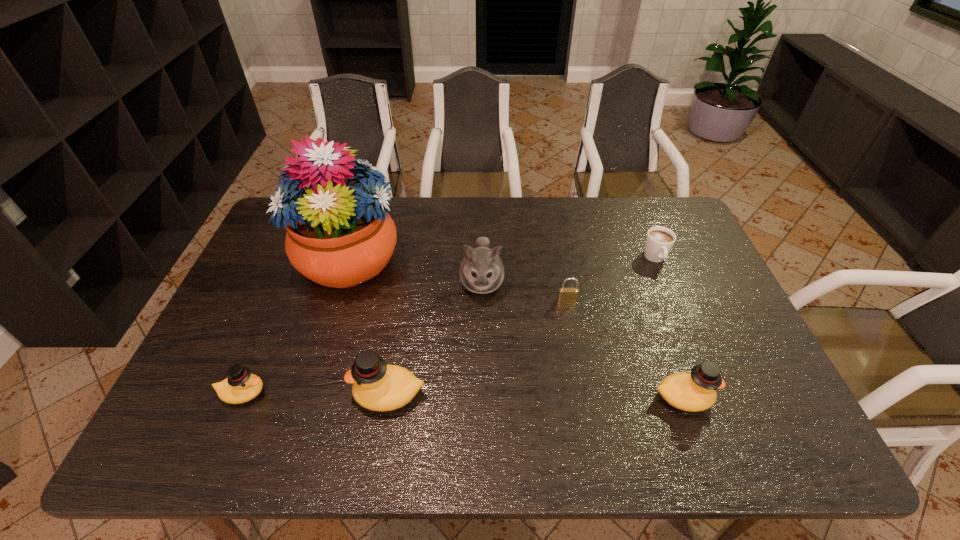
I want to click on duck that is at the right edge, so click(x=696, y=391).

Where is `cappuccino that is positioned at the right edge`? This screenshot has width=960, height=540. cappuccino that is positioned at the right edge is located at coordinates (659, 241).

The width and height of the screenshot is (960, 540). Identify the location of object present at the far left corner. (339, 235).

The width and height of the screenshot is (960, 540). I want to click on object at the near left corner, so click(241, 386).

Where is `object that is at the near right corner`? object that is at the near right corner is located at coordinates (696, 391).

Identify the location of vacant area at the far edge of the desktop. (550, 203).

Locate an element on the screen. The width and height of the screenshot is (960, 540). free space at the near edge is located at coordinates (286, 400).

Locate an element on the screen. free space at the left edge of the desktop is located at coordinates (206, 362).

At what (x,y) coordinates should I click in order to perform the action: click on vacant space at the right edge of the desktop. Please return your answer as a coordinate pair (x, y). The height and width of the screenshot is (540, 960). Looking at the image, I should click on (684, 299).

Locate an element on the screen. Image resolution: width=960 pixels, height=540 pixels. vacant space at the far right corner of the desktop is located at coordinates pyautogui.click(x=649, y=220).